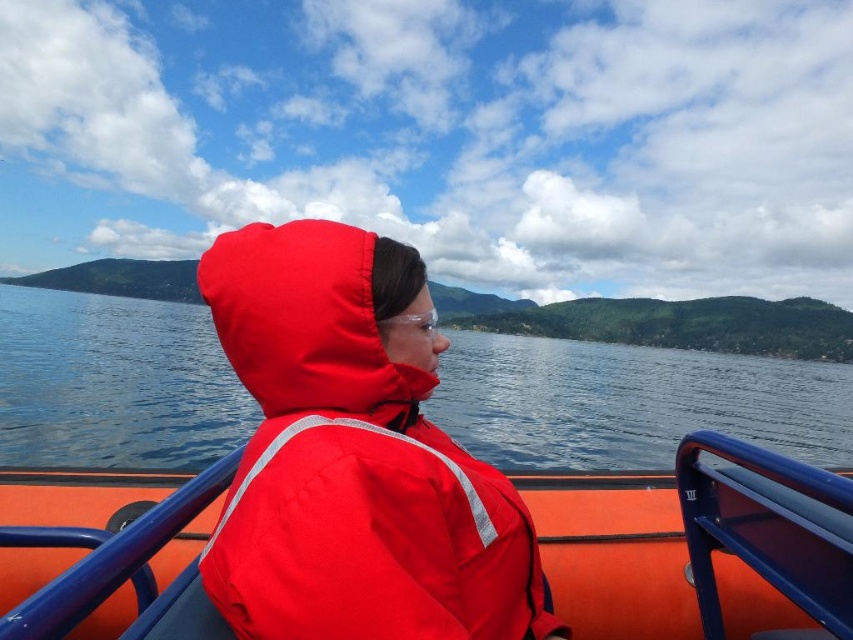
Question: Among these points, which one is nearest to the camera?

Choices:
 (A) (297, 554)
 (B) (743, 544)
 (C) (119, 381)

Answer: (A)

Question: Can you confirm if blue water at center is wider than matte red life jacket at center?

Choices:
 (A) yes
 (B) no

Answer: (A)

Question: Does blue water at center have a lesser width compared to matte red jacket at center?

Choices:
 (A) yes
 (B) no

Answer: (B)

Question: Among these objects, which one is farthest from the camera?

Choices:
 (A) matte red life jacket at center
 (B) blue water at center
 (C) matte red jacket at center

Answer: (C)

Question: Considering the relative positions of matte red jacket at center and matte red life jacket at center in the image provided, where is matte red jacket at center located with respect to matte red life jacket at center?

Choices:
 (A) below
 (B) above

Answer: (A)

Question: Which object is the closest to the blue water at center?

Choices:
 (A) matte red life jacket at center
 (B) matte red jacket at center

Answer: (A)